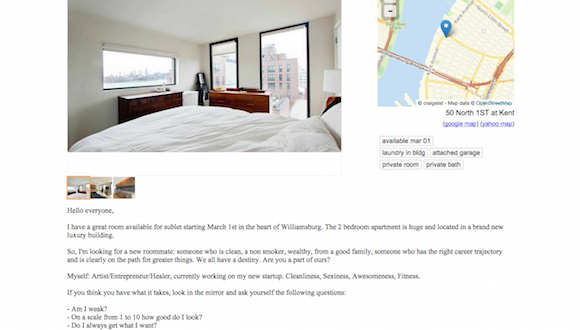
Where is `room`? The width and height of the screenshot is (580, 330). room is located at coordinates (79, 188), (102, 192), (126, 192), (118, 94).